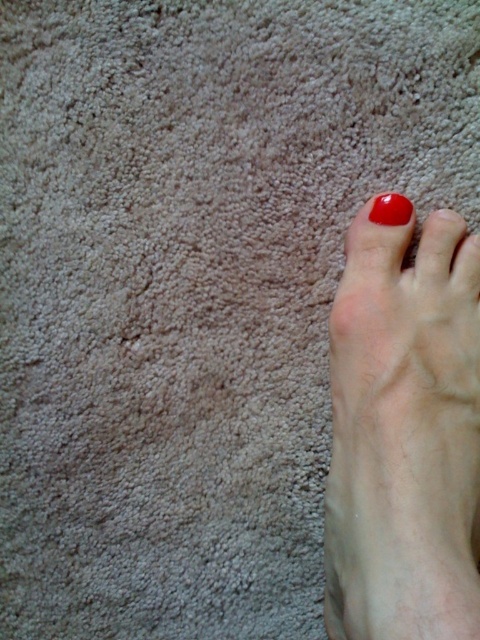
You are a nail technician observing the foot and its nail. Can you determine which object is bigger between the smooth skin foot at lower right and the glossy red nail at upper right?

The smooth skin foot at lower right is larger in size than the glossy red nail at upper right.

You are a photographer adjusting the lighting for a closeup shot of a foot on a textured carpet. You need to ensure both the smooth skin foot at lower right and the glossy red nail at upper right are well lit. Which object should you move closer to the light source to highlight its texture?

The smooth skin foot at lower right should be moved closer to the light source because it is positioned on the left side of the glossy red nail at upper right, so adjusting its position can better highlight its texture under the light.